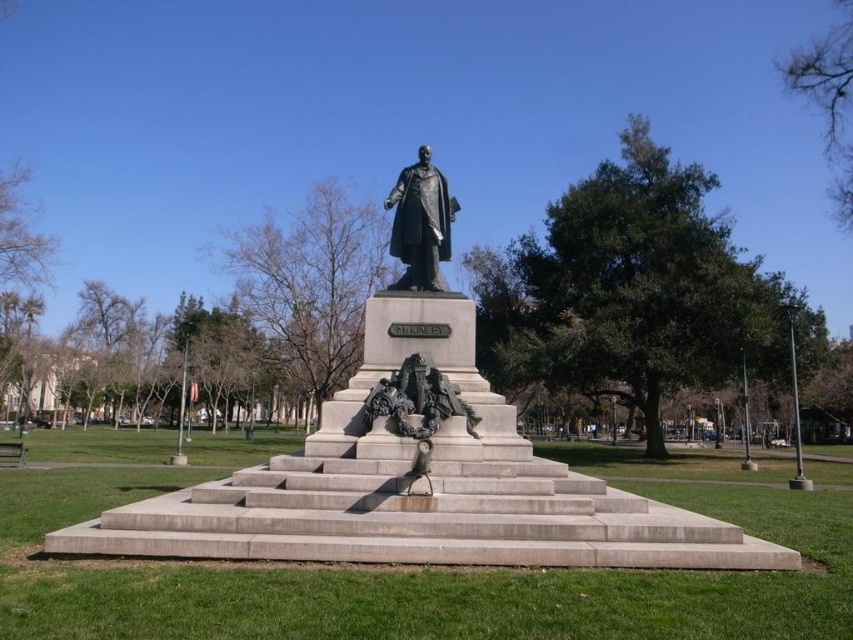
Question: Is bronze statue at center above bronze dragon at center?

Choices:
 (A) yes
 (B) no

Answer: (A)

Question: Does bronze statue at center appear on the right side of bronze dragon at center?

Choices:
 (A) no
 (B) yes

Answer: (B)

Question: Which of the following is the farthest from the observer?

Choices:
 (A) bronze statue at center
 (B) bronze dragon at center

Answer: (A)

Question: Which object is farther from the camera taking this photo?

Choices:
 (A) bronze statue at center
 (B) bronze dragon at center

Answer: (A)

Question: Is bronze statue at center further to the viewer compared to bronze dragon at center?

Choices:
 (A) no
 (B) yes

Answer: (B)